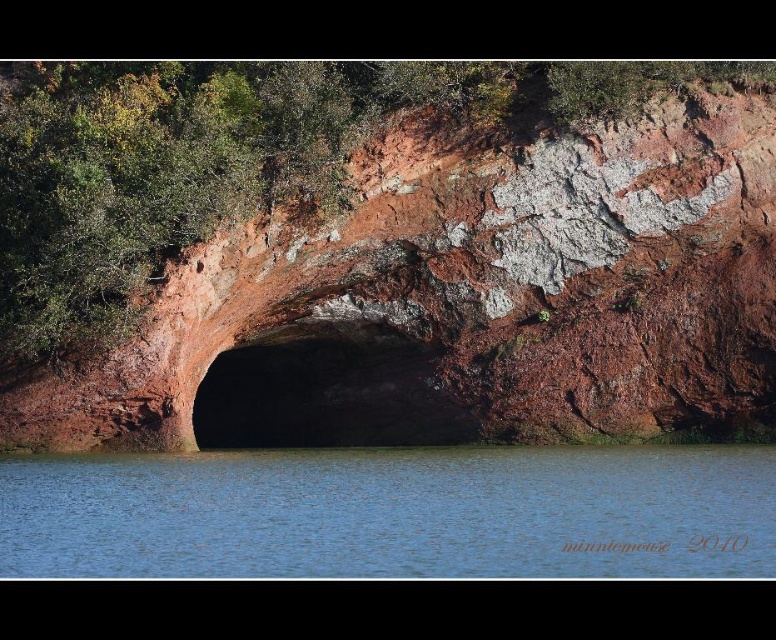
Question: Is blue water at center above brown rough cave at center?

Choices:
 (A) no
 (B) yes

Answer: (A)

Question: Which of the following is the closest to the observer?

Choices:
 (A) (373, 385)
 (B) (608, 528)
 (C) (417, 321)

Answer: (B)

Question: Is blue water at center to the left of brown rough cave at center from the viewer's perspective?

Choices:
 (A) no
 (B) yes

Answer: (A)

Question: Which object is closer to the camera taking this photo?

Choices:
 (A) rusty rock cave at center
 (B) blue water at center

Answer: (B)

Question: Is rusty rock cave at center further to the viewer compared to brown rough cave at center?

Choices:
 (A) yes
 (B) no

Answer: (B)

Question: Which object is the closest to the blue water at center?

Choices:
 (A) rusty rock cave at center
 (B) brown rough cave at center

Answer: (A)